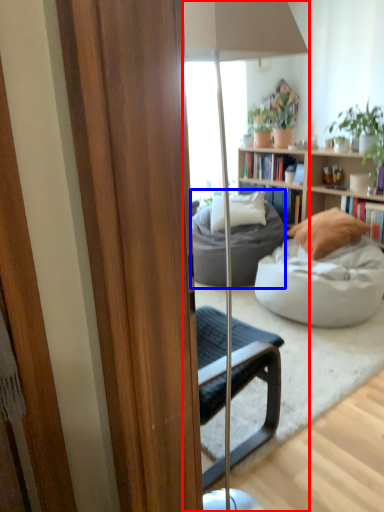
Question: Which object appears farthest to the camera in this image, lamp (highlighted by a red box) or studio couch (highlighted by a blue box)?

Choices:
 (A) lamp
 (B) studio couch

Answer: (B)